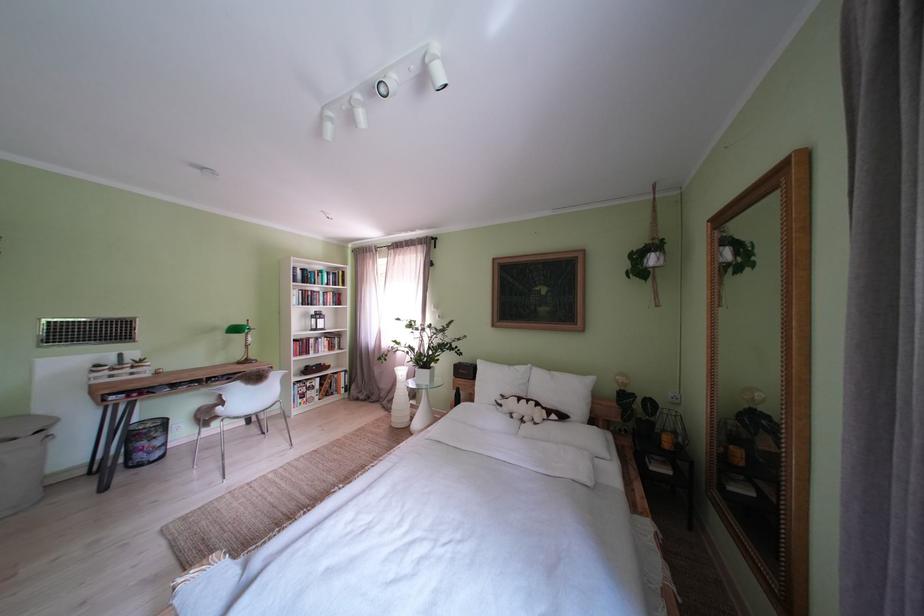
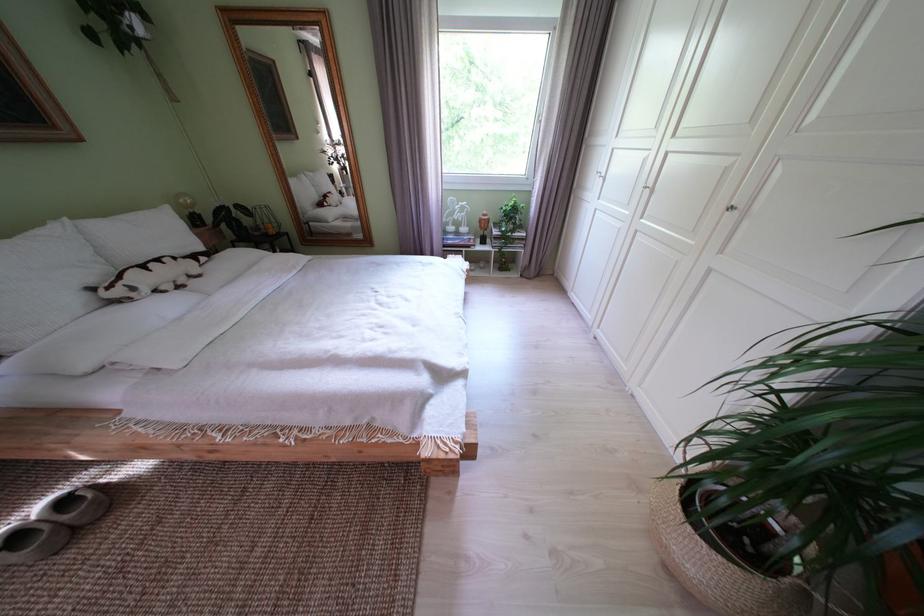
Locate, in the second image, the point that corresponds to pixel 512 411 in the first image.

(146, 294)